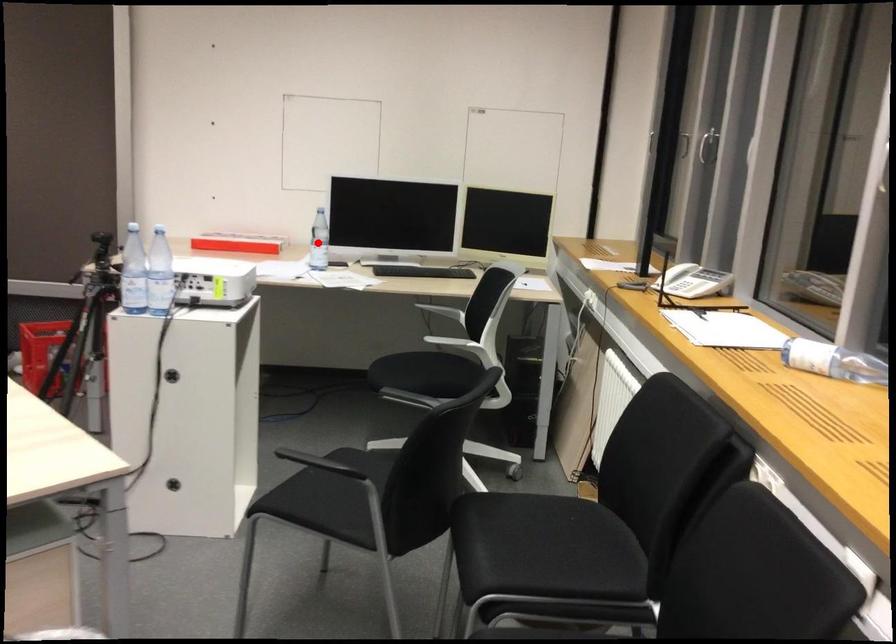
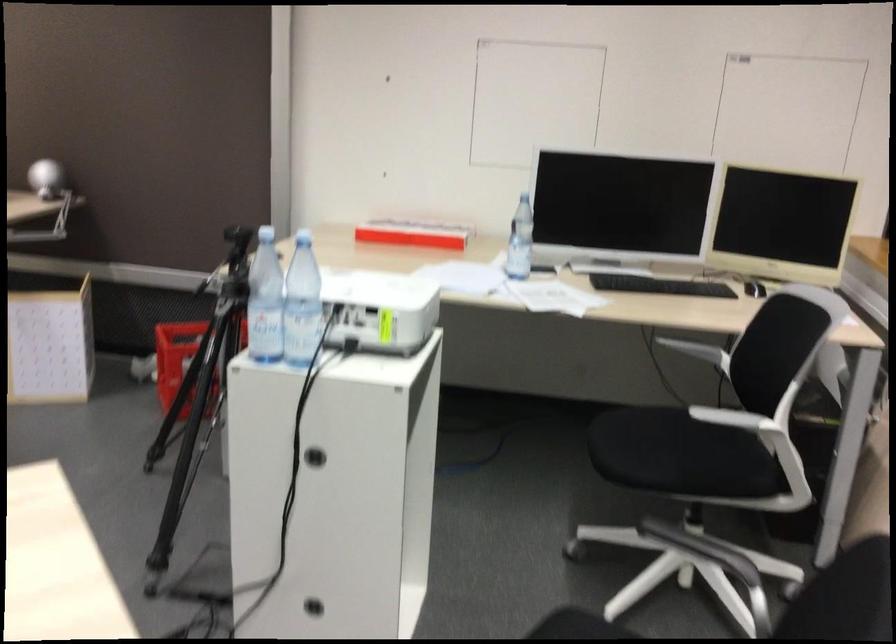
Question: I am providing you with two images of the same scene from different viewpoints. Given a red point in image1, look at the same physical point in image2. Is it:

Choices:
 (A) Closer to the viewpoint
 (B) Farther from the viewpoint

Answer: (A)